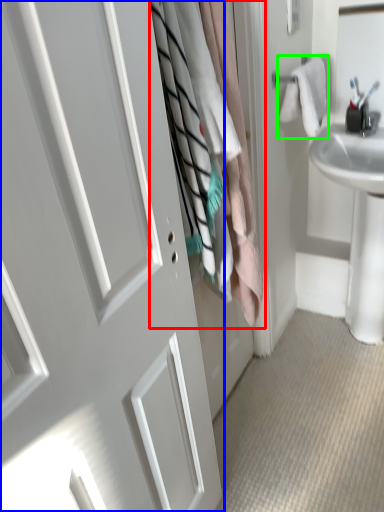
Question: Which is farther away from laundry (highlighted by a red box)? door (highlighted by a blue box) or bath towel (highlighted by a green box)?

Choices:
 (A) door
 (B) bath towel

Answer: (B)